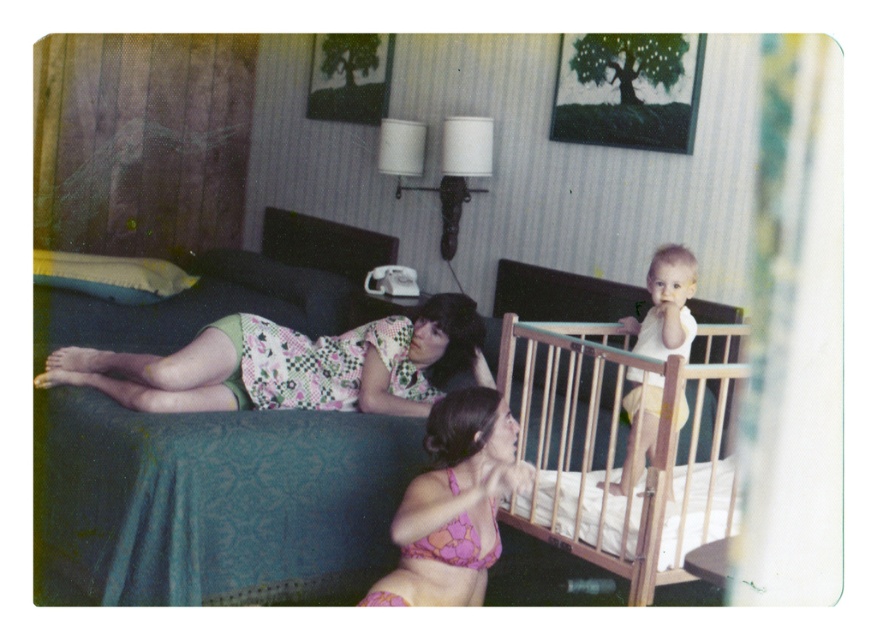
You are a photographer in a hotel room and you see the pink floral bikini top at lower center and the white matte baby at center. Which object is located to the left of the other?

The pink floral bikini top at lower center is positioned on the left side of white matte baby at center.